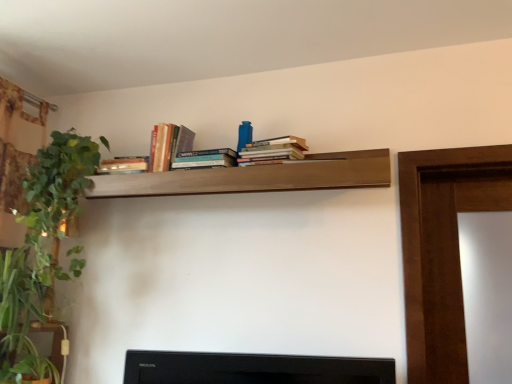
Question: Can you confirm if hardcover books at center, positioned as the second book in right-to-left order, is wider than green leafy plant at left?

Choices:
 (A) no
 (B) yes

Answer: (A)

Question: Does hardcover books at center, the 2th book viewed from the left, come in front of green leafy plant at left?

Choices:
 (A) yes
 (B) no

Answer: (B)

Question: Can you confirm if hardcover books at center, the 2th book viewed from the left, is positioned to the left of green leafy plant at left?

Choices:
 (A) no
 (B) yes

Answer: (A)

Question: Is hardcover books at center, the 2th book viewed from the left, at the right side of green leafy plant at left?

Choices:
 (A) yes
 (B) no

Answer: (A)

Question: Is hardcover books at center, the 2th book viewed from the left, oriented away from green leafy plant at left?

Choices:
 (A) yes
 (B) no

Answer: (B)

Question: Considering the relative positions of hardcover books at center, positioned as the second book in right-to-left order, and green leafy plant at left in the image provided, is hardcover books at center, positioned as the second book in right-to-left order, behind green leafy plant at left?

Choices:
 (A) no
 (B) yes

Answer: (B)

Question: Is hardcover books at upper center, arranged as the 3th book when viewed from the right, turned away from green leafy plant at left?

Choices:
 (A) no
 (B) yes

Answer: (A)

Question: Is the surface of hardcover books at upper center, arranged as the 3th book when viewed from the right, in direct contact with green leafy plant at left?

Choices:
 (A) no
 (B) yes

Answer: (A)

Question: Is hardcover books at upper center, arranged as the 3th book when viewed from the right, smaller than green leafy plant at left?

Choices:
 (A) no
 (B) yes

Answer: (B)

Question: Does hardcover books at upper center, arranged as the 3th book when viewed from the right, appear on the right side of green leafy plant at left?

Choices:
 (A) no
 (B) yes

Answer: (B)

Question: From the image's perspective, is hardcover books at upper center, arranged as the 3th book when viewed from the right, located beneath green leafy plant at left?

Choices:
 (A) yes
 (B) no

Answer: (B)

Question: Is hardcover books at upper center, the first book viewed from the left, taller than green leafy plant at left?

Choices:
 (A) yes
 (B) no

Answer: (B)

Question: Is wooden shelf at upper center oriented away from green leafy plant at left?

Choices:
 (A) yes
 (B) no

Answer: (B)